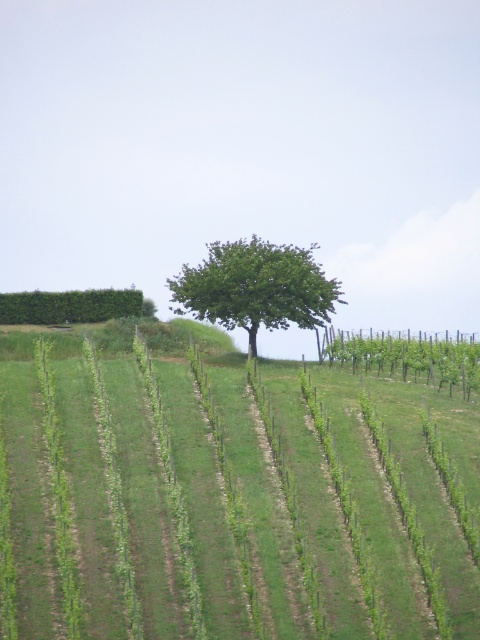
Between point (280, 528) and point (233, 262), which one is positioned behind?

Point (233, 262)

Between green grassy field at center and green leafy tree at center, which one has more height?

Standing taller between the two is green leafy tree at center.

Identify the location of green grassy field at center. The image size is (480, 640). (232, 492).